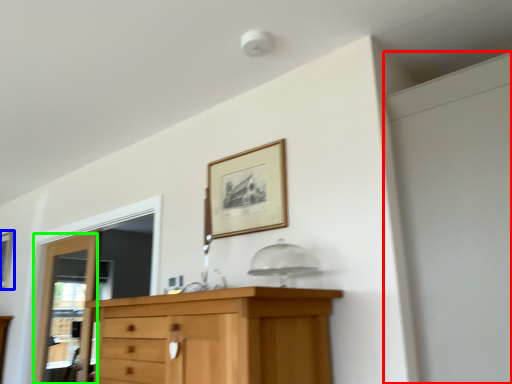
Question: Considering the real-world distances, which object is farthest from screen door (highlighted by a red box)? picture frame (highlighted by a blue box) or door (highlighted by a green box)?

Choices:
 (A) picture frame
 (B) door

Answer: (A)